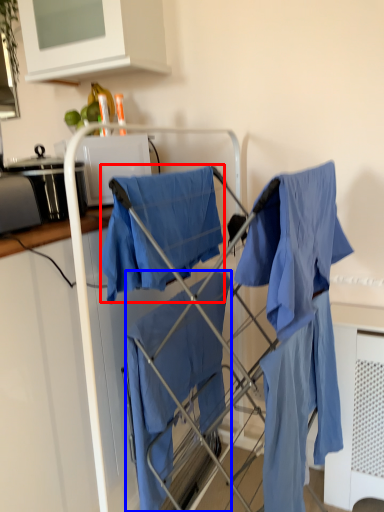
Question: Which of the following is the farthest to the observer, cloak (highlighted by a red box) or cloak (highlighted by a blue box)?

Choices:
 (A) cloak
 (B) cloak

Answer: (B)